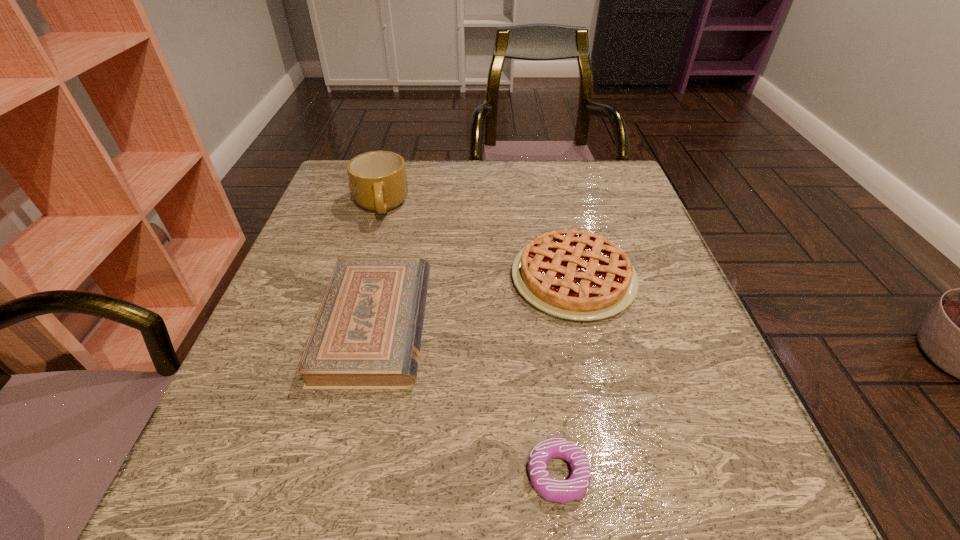
This screenshot has height=540, width=960. Identify the location of vacant area that satisfies the following two spatial constraints: 1. on the spine side of the Bible; 2. on the left side of the nearest object. (341, 474).

Where is `free space that satisfies the following two spatial constraints: 1. on the side with the handle of the pie; 2. on the right side of the tallest object`? The image size is (960, 540). free space that satisfies the following two spatial constraints: 1. on the side with the handle of the pie; 2. on the right side of the tallest object is located at coordinates (360, 278).